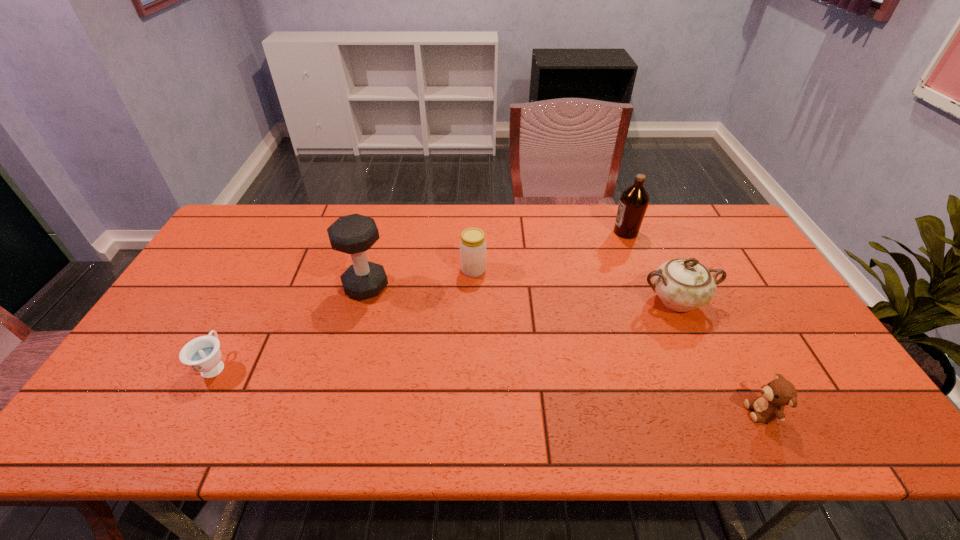
At what (x,y) coordinates should I click in order to perform the action: click on dumbbell. Please return your answer as a coordinate pair (x, y). Looking at the image, I should click on (354, 234).

This screenshot has height=540, width=960. I want to click on olive oil, so (634, 200).

At what (x,y) coordinates should I click in order to perform the action: click on the fourth shortest object. Please return your answer as a coordinate pair (x, y). Image resolution: width=960 pixels, height=540 pixels. Looking at the image, I should click on (682, 284).

The width and height of the screenshot is (960, 540). In order to click on jar in this screenshot , I will do `click(473, 247)`.

In order to click on the fourth object from right to left in this screenshot , I will do `click(473, 247)`.

Where is `teddy bear`? This screenshot has height=540, width=960. teddy bear is located at coordinates (768, 407).

This screenshot has height=540, width=960. I want to click on the nearest object, so click(768, 407).

Identify the location of the shortest object. (202, 354).

Identify the location of the leftmost object. (202, 354).

Locate an element on the screen. vacant space located on the right of the dumbbell is located at coordinates (449, 287).